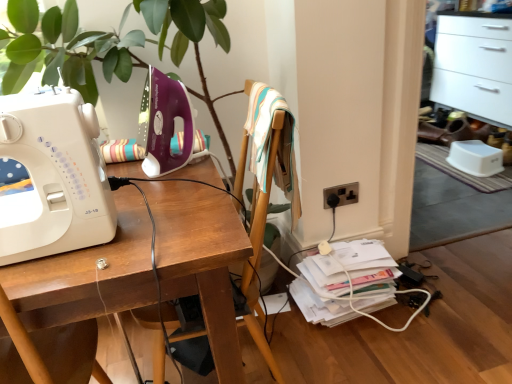
The width and height of the screenshot is (512, 384). Describe the element at coordinates (201, 260) in the screenshot. I see `wooden desk at center` at that location.

Locate an element on the screen. white glossy file cabinet at upper right is located at coordinates (474, 66).

Locate an element on the screen. This screenshot has height=384, width=512. black plastic electric outlet at lower right is located at coordinates (342, 194).

In order to face white plastic sewing machine at left, the first sewing machine positioned from the front, should I rotate leftwards or rightwards?

You should rotate left by 27.041 degrees.

At what (x,y) coordinates should I click in order to perform the action: click on wooden chair at center. Please return your answer as a coordinate pair (x, y). This screenshot has height=384, width=512. Looking at the image, I should click on (268, 189).

How much distance is there between white glossy file cabinet at upper right and wooden chair at center?

2.47 meters.

Is white glossy file cabinet at upper right in front of or behind wooden chair at center in the image?

Clearly, white glossy file cabinet at upper right is behind wooden chair at center.

Does white glossy file cabinet at upper right touch wooden chair at center?

white glossy file cabinet at upper right and wooden chair at center are clearly separated.

Can you confirm if white glossy file cabinet at upper right is smaller than wooden chair at center?

Actually, white glossy file cabinet at upper right might be larger than wooden chair at center.

Who is more distant, black plastic electric outlet at lower right or wooden chair at center?

black plastic electric outlet at lower right is behind.

Considering the sizes of objects black plastic electric outlet at lower right and wooden chair at center in the image provided, who is wider, black plastic electric outlet at lower right or wooden chair at center?

wooden chair at center.

Locate an element on the screen. This screenshot has width=512, height=384. chair below the black plastic electric outlet at lower right (from the image's perspective) is located at coordinates coord(268,189).

Can you confirm if black plastic electric outlet at lower right is smaller than wooden chair at center?

Correct, black plastic electric outlet at lower right occupies less space than wooden chair at center.

Does point (172, 137) come farther from viewer compared to point (490, 119)?

No, (172, 137) is closer to viewer.

Find the location of `sewing machine that is the 1st object to the left of the white glossy file cabinet at upper right, starting at the anchor`. sewing machine that is the 1st object to the left of the white glossy file cabinet at upper right, starting at the anchor is located at coordinates (164, 123).

Is white glossy file cabinet at upper right at the back of purple plastic sewing machine at upper left, the 1th sewing machine when ordered from back to front?

purple plastic sewing machine at upper left, the 1th sewing machine when ordered from back to front, does not have its back to white glossy file cabinet at upper right.

Who is smaller, purple plastic sewing machine at upper left, placed as the second sewing machine when sorted from front to back, or white glossy file cabinet at upper right?

purple plastic sewing machine at upper left, placed as the second sewing machine when sorted from front to back, is smaller.

Is purple plastic sewing machine at upper left, placed as the second sewing machine when sorted from front to back, positioned beyond the bounds of black plastic electric outlet at lower right?

Yes, purple plastic sewing machine at upper left, placed as the second sewing machine when sorted from front to back, is located beyond the bounds of black plastic electric outlet at lower right.

Is purple plastic sewing machine at upper left, the 1th sewing machine when ordered from back to front, thinner than black plastic electric outlet at lower right?

No, purple plastic sewing machine at upper left, the 1th sewing machine when ordered from back to front, is not thinner than black plastic electric outlet at lower right.

In the image, is purple plastic sewing machine at upper left, the 1th sewing machine when ordered from back to front, positioned in front of or behind black plastic electric outlet at lower right?

Clearly, purple plastic sewing machine at upper left, the 1th sewing machine when ordered from back to front, is in front of black plastic electric outlet at lower right.

Identify the location of the 1st sewing machine counting from the left side of the black plastic electric outlet at lower right. This screenshot has width=512, height=384. (164, 123).

Considering the sizes of objects wooden chair at center and wooden desk at center in the image provided, who is shorter, wooden chair at center or wooden desk at center?

With less height is wooden desk at center.

I want to click on chair above the wooden desk at center (from a real-world perspective), so click(268, 189).

Is wooden chair at center positioned behind wooden desk at center?

That is True.

Is wooden desk at center a part of wooden chair at center?

No, wooden chair at center does not contain wooden desk at center.

From the image's perspective, which object appears higher, white plastic sewing machine at left, the 2th sewing machine viewed from the back, or wooden chair at center?

white plastic sewing machine at left, the 2th sewing machine viewed from the back, from the image's perspective.

Consider the image. Is white plastic sewing machine at left, the first sewing machine positioned from the front, not close to wooden chair at center?

That's not correct — white plastic sewing machine at left, the first sewing machine positioned from the front, is a little close to wooden chair at center.

Is purple plastic sewing machine at upper left, placed as the second sewing machine when sorted from front to back, surrounded by black plastic electric outlet at lower right?

No, purple plastic sewing machine at upper left, placed as the second sewing machine when sorted from front to back, is not a part of black plastic electric outlet at lower right.

From the image's perspective, starting from the black plastic electric outlet at lower right, which sewing machine is the 2nd one above? Please provide its 2D coordinates.

[(164, 123)]

How different are the orientations of black plastic electric outlet at lower right and purple plastic sewing machine at upper left, placed as the second sewing machine when sorted from front to back, in degrees?

3.77 degrees.

Is black plastic electric outlet at lower right placed right next to purple plastic sewing machine at upper left, placed as the second sewing machine when sorted from front to back?

No, black plastic electric outlet at lower right is not in contact with purple plastic sewing machine at upper left, placed as the second sewing machine when sorted from front to back.

The width and height of the screenshot is (512, 384). In the image, there is a white glossy file cabinet at upper right. What are the coordinates of `chair below it (from the image's perspective)` in the screenshot? It's located at (268, 189).

Find the location of a particular element. The image size is (512, 384). electric outlet above the wooden chair at center (from the image's perspective) is located at coordinates (342, 194).

From the image, which object appears to be farther from wooden desk at center, white plastic sewing machine at left, the first sewing machine positioned from the front, or purple plastic sewing machine at upper left, the 1th sewing machine when ordered from back to front?

purple plastic sewing machine at upper left, the 1th sewing machine when ordered from back to front.

From the image, which object appears to be farther from purple plastic sewing machine at upper left, placed as the second sewing machine when sorted from front to back, wooden desk at center or black plastic electric outlet at lower right?

The object further to purple plastic sewing machine at upper left, placed as the second sewing machine when sorted from front to back, is black plastic electric outlet at lower right.

Which object lies further to the anchor point black plastic electric outlet at lower right, wooden chair at center or wooden desk at center?

wooden desk at center lies further to black plastic electric outlet at lower right than the other object.

From the image, which object appears to be farther from purple plastic sewing machine at upper left, the 1th sewing machine when ordered from back to front, wooden desk at center or white plastic sewing machine at left, the 2th sewing machine viewed from the back?

white plastic sewing machine at left, the 2th sewing machine viewed from the back, is further to purple plastic sewing machine at upper left, the 1th sewing machine when ordered from back to front.

In the scene shown: Which object lies nearer to the anchor point wooden desk at center, purple plastic sewing machine at upper left, placed as the second sewing machine when sorted from front to back, or white glossy file cabinet at upper right?

Based on the image, purple plastic sewing machine at upper left, placed as the second sewing machine when sorted from front to back, appears to be nearer to wooden desk at center.

Estimate the real-world distances between objects in this image. Which object is further from black plastic electric outlet at lower right, wooden desk at center or white glossy file cabinet at upper right?

The object further to black plastic electric outlet at lower right is white glossy file cabinet at upper right.

When comparing their distances from wooden desk at center, does black plastic electric outlet at lower right or white glossy file cabinet at upper right seem further?

white glossy file cabinet at upper right lies further to wooden desk at center than the other object.

From the picture: Considering their positions, is wooden chair at center positioned further to black plastic electric outlet at lower right than white plastic sewing machine at left, the first sewing machine positioned from the front?

white plastic sewing machine at left, the first sewing machine positioned from the front, is positioned further to the anchor black plastic electric outlet at lower right.

Locate an element on the screen. The image size is (512, 384). sewing machine between purple plastic sewing machine at upper left, the 1th sewing machine when ordered from back to front, and wooden chair at center vertically is located at coordinates (53, 178).

Image resolution: width=512 pixels, height=384 pixels. Find the location of `sewing machine located between white plastic sewing machine at left, the first sewing machine positioned from the front, and black plastic electric outlet at lower right in the depth direction`. sewing machine located between white plastic sewing machine at left, the first sewing machine positioned from the front, and black plastic electric outlet at lower right in the depth direction is located at coordinates (164, 123).

The height and width of the screenshot is (384, 512). I want to click on chair between purple plastic sewing machine at upper left, placed as the second sewing machine when sorted from front to back, and wooden desk at center in the up-down direction, so click(268, 189).

The image size is (512, 384). In order to click on chair situated between purple plastic sewing machine at upper left, placed as the second sewing machine when sorted from front to back, and white glossy file cabinet at upper right from left to right in this screenshot , I will do `click(268, 189)`.